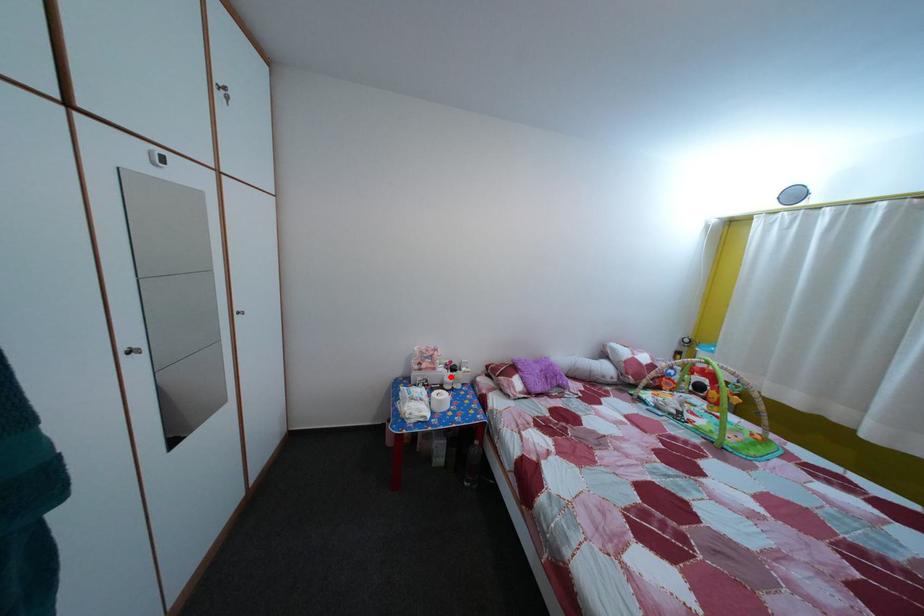
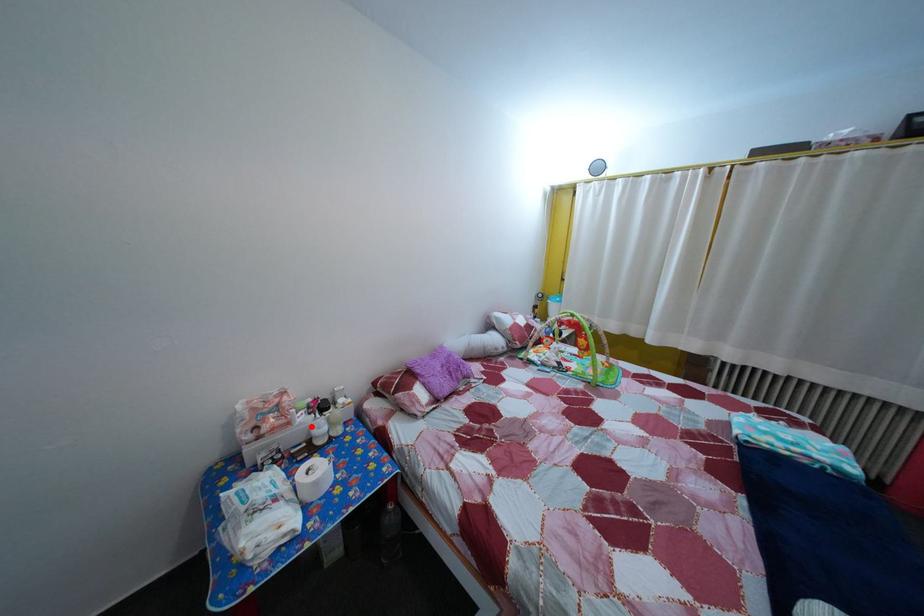
I am providing you with two images of the same scene from different viewpoints. A red point is marked on the first image and another point is marked on the second image. Are the points marked in image1 and image2 representing the same 3D position?

Yes